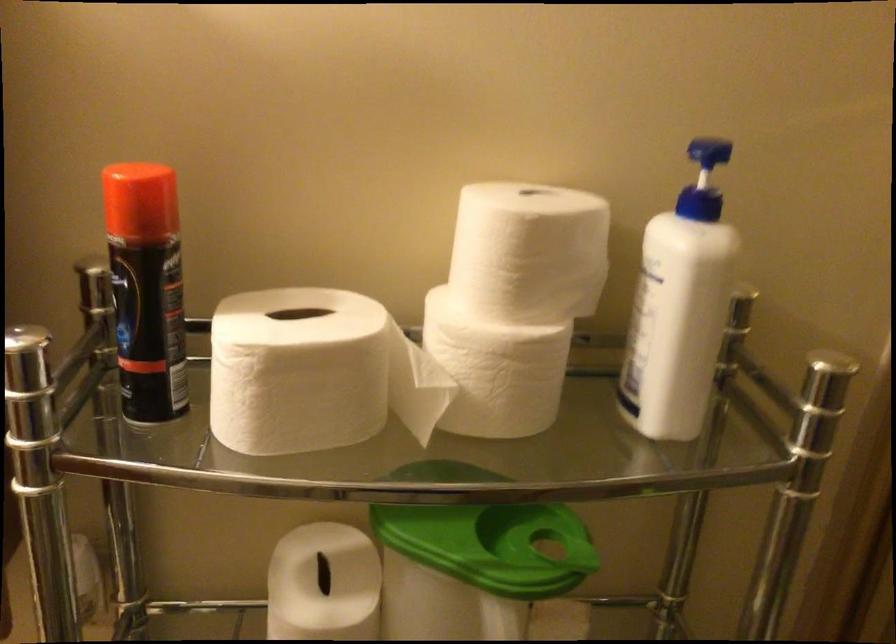
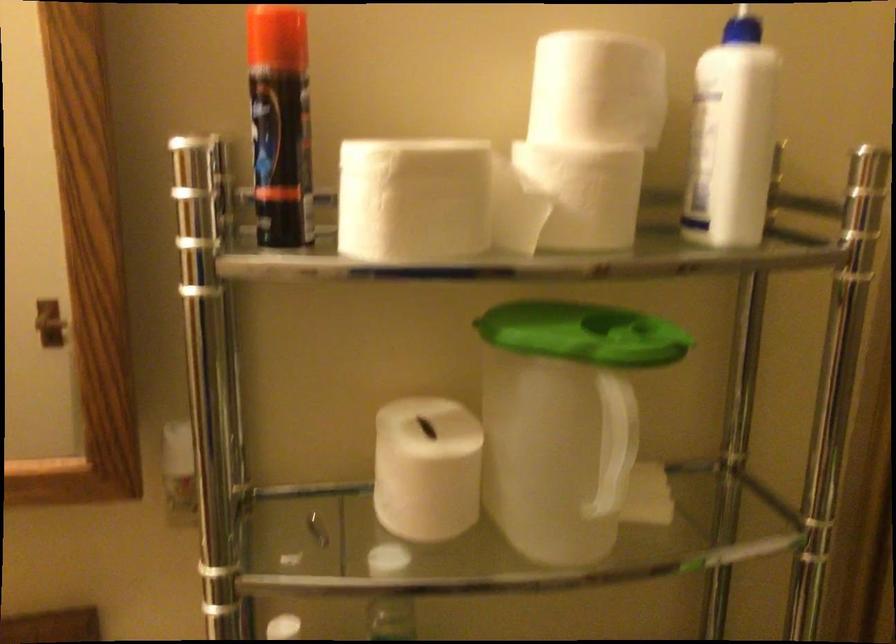
Find the pixel in the second image that matches point (676, 313) in the first image.

(731, 137)